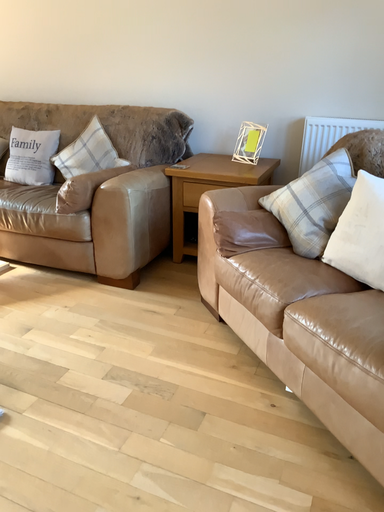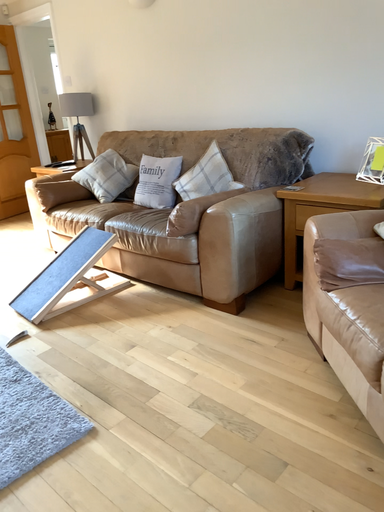
Question: How did the camera likely rotate when shooting the video?

Choices:
 (A) rotated right
 (B) rotated left

Answer: (B)